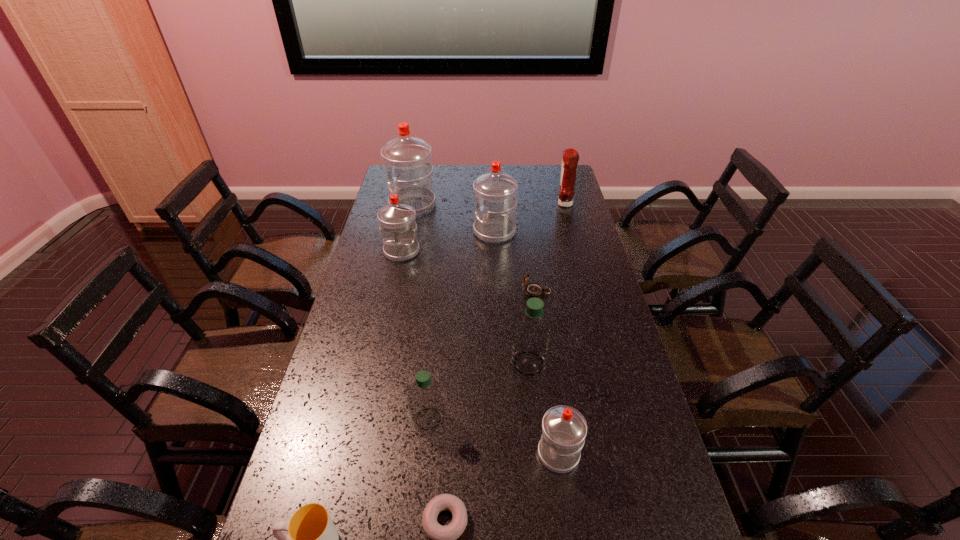
Identify the location of vacant space located on the handle side of the nearest white water bottle. This screenshot has height=540, width=960. (430, 454).

This screenshot has height=540, width=960. Identify the location of vacant space located 0.310m on the handle side of the nearest white water bottle. (409, 454).

Find the location of a particular element. The width and height of the screenshot is (960, 540). vacant region located on the handle side of the nearest white water bottle is located at coordinates (372, 454).

Find the location of `vacant space positioned 0.130m on the face of the sixth nearest object`. vacant space positioned 0.130m on the face of the sixth nearest object is located at coordinates (484, 291).

You are a GUI agent. You are given a task and a screenshot of the screen. Output one action in this format:
    pyautogui.click(x=<x>, y=<y>)
    Task: Click on the vacant space located on the face of the sixth nearest object
    The height and width of the screenshot is (540, 960).
    Given the screenshot: What is the action you would take?
    pyautogui.click(x=448, y=291)

This screenshot has width=960, height=540. What are the coordinates of `vacant space located 0.170m on the face of the sixth nearest object` in the screenshot? It's located at (472, 291).

Locate an element on the screen. object that is positioned at the right edge is located at coordinates [570, 159].

Where is `vacant region at the far edge of the desktop`? vacant region at the far edge of the desktop is located at coordinates (478, 168).

In the image, there is a desktop. In order to click on vacant space at the left edge in this screenshot , I will do `click(361, 306)`.

In the image, there is a desktop. At what (x,y) coordinates should I click in order to perform the action: click on free region at the right edge. Please return your answer as a coordinate pair (x, y). This screenshot has width=960, height=540. Looking at the image, I should click on (588, 243).